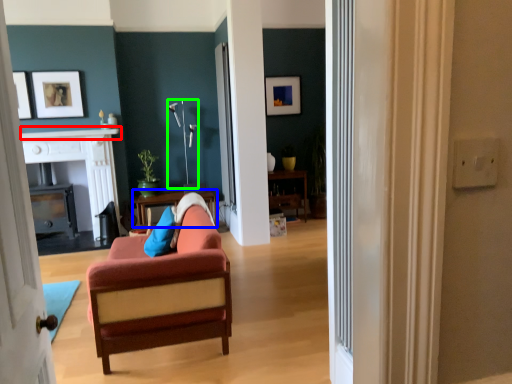
Question: Which object is the farthest from mantle (highlighted by a red box)? Choose among these: table (highlighted by a blue box) or lamp (highlighted by a green box).

Choices:
 (A) table
 (B) lamp

Answer: (A)